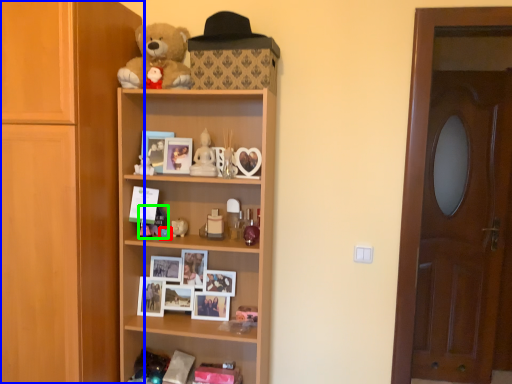
Question: Which object is positioned closest to toy (highlighted by a red box)? Select from cupboard (highlighted by a blue box) and toy (highlighted by a green box).

Choices:
 (A) cupboard
 (B) toy

Answer: (B)